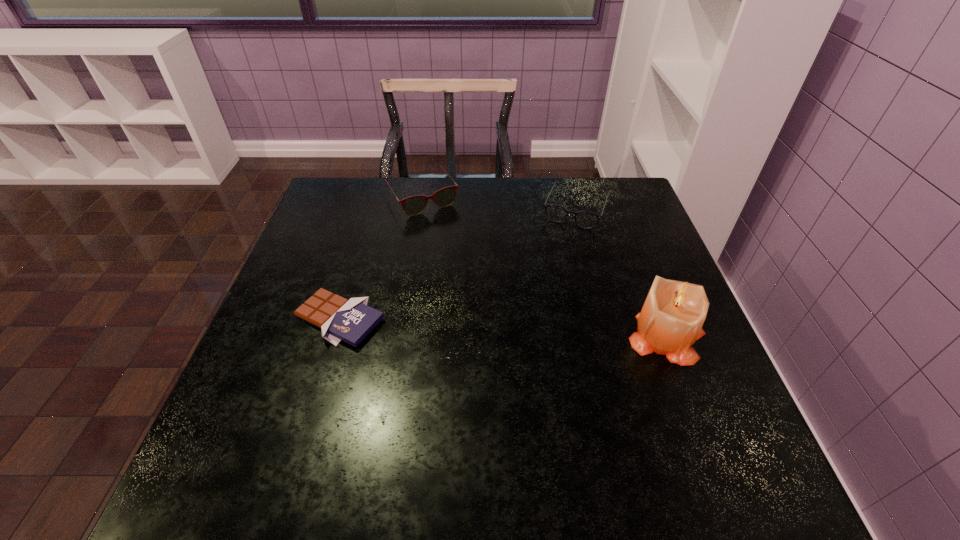
Where is `free space on the desktop that is between the shortest object and the candle and is positioned through the lenses of the right spectacles`? The height and width of the screenshot is (540, 960). free space on the desktop that is between the shortest object and the candle and is positioned through the lenses of the right spectacles is located at coordinates (529, 330).

At what (x,y) coordinates should I click in order to perform the action: click on free space on the desktop that is between the shortest object and the tallest object and is positioned at the front view of the left spectacles. Please return your answer as a coordinate pair (x, y). This screenshot has height=540, width=960. Looking at the image, I should click on (x=516, y=329).